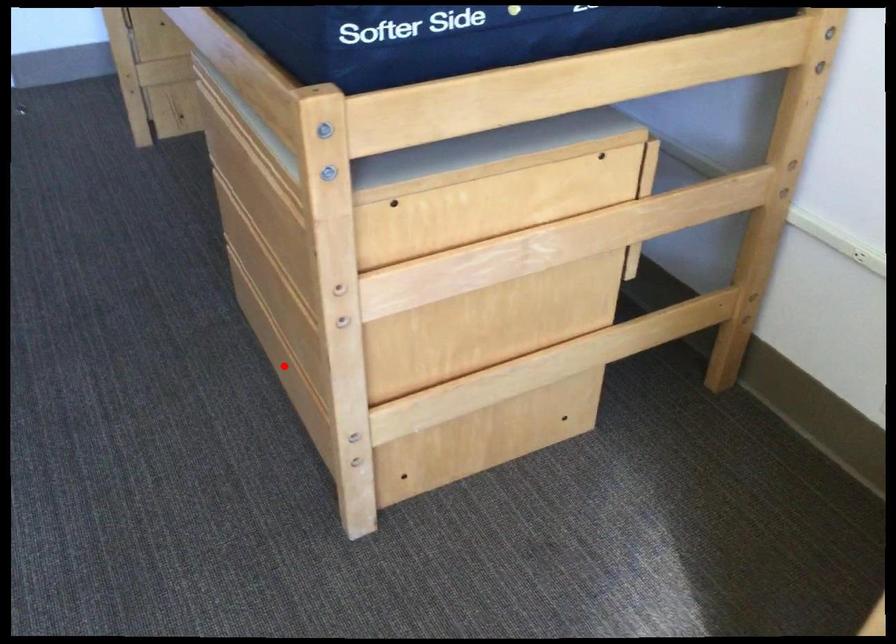
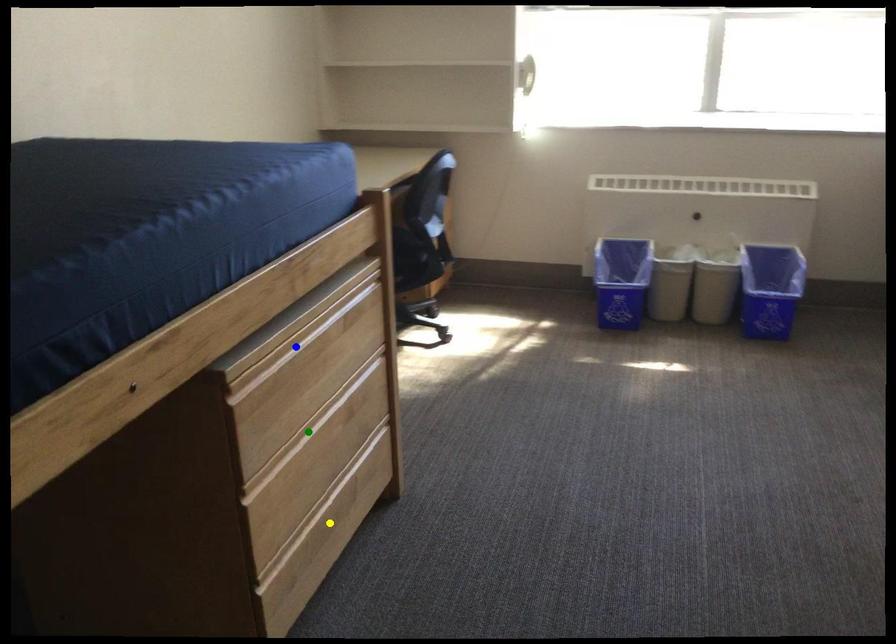
Question: I am providing you with two images of the same scene from different viewpoints. A red point is marked on the first image. You are given multiple points on the second image. In image 2, which mark is for the same physical point as the one in image 1?

Choices:
 (A) green point
 (B) blue point
 (C) yellow point

Answer: (C)